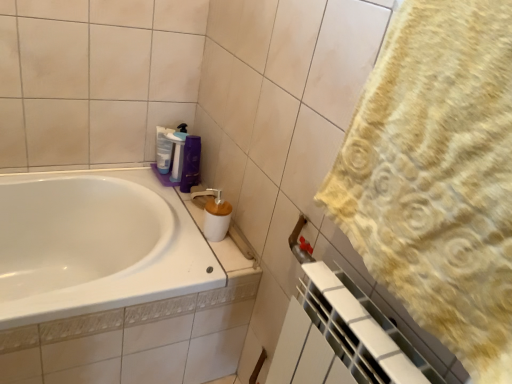
Question: In which direction should I rotate to look at translucent plastic bottle at upper center, the second cleaning product in the right-to-left sequence?

Choices:
 (A) right
 (B) left

Answer: (B)

Question: Does purple glossy shampoo at upper center lie behind translucent plastic bottle at upper center, acting as the first cleaning product starting from the left?

Choices:
 (A) yes
 (B) no

Answer: (B)

Question: Is purple glossy shampoo at upper center looking in the opposite direction of translucent plastic bottle at upper center, acting as the first cleaning product starting from the left?

Choices:
 (A) no
 (B) yes

Answer: (A)

Question: Considering the relative positions of purple glossy shampoo at upper center and translucent plastic bottle at upper center, the second cleaning product in the right-to-left sequence, in the image provided, is purple glossy shampoo at upper center in front of translucent plastic bottle at upper center, the second cleaning product in the right-to-left sequence,?

Choices:
 (A) no
 (B) yes

Answer: (B)

Question: Is purple glossy shampoo at upper center at the right side of translucent plastic bottle at upper center, acting as the first cleaning product starting from the left?

Choices:
 (A) yes
 (B) no

Answer: (A)

Question: Considering the relative sizes of purple glossy shampoo at upper center and translucent plastic bottle at upper center, the second cleaning product in the right-to-left sequence, in the image provided, is purple glossy shampoo at upper center smaller than translucent plastic bottle at upper center, the second cleaning product in the right-to-left sequence,?

Choices:
 (A) yes
 (B) no

Answer: (B)

Question: Is purple glossy shampoo at upper center not within translucent plastic bottle at upper center, acting as the first cleaning product starting from the left?

Choices:
 (A) no
 (B) yes

Answer: (B)

Question: Is purple glossy shampoo at upper center shorter than yellow textured towel at right?

Choices:
 (A) no
 (B) yes

Answer: (B)

Question: From a real-world perspective, is purple glossy shampoo at upper center physically below yellow textured towel at right?

Choices:
 (A) yes
 (B) no

Answer: (A)

Question: Does purple glossy shampoo at upper center appear on the right side of yellow textured towel at right?

Choices:
 (A) no
 (B) yes

Answer: (A)

Question: Is purple glossy shampoo at upper center facing away from yellow textured towel at right?

Choices:
 (A) no
 (B) yes

Answer: (A)

Question: Does purple glossy shampoo at upper center have a greater height compared to yellow textured towel at right?

Choices:
 (A) no
 (B) yes

Answer: (A)

Question: Is purple glossy shampoo at upper center surrounding yellow textured towel at right?

Choices:
 (A) yes
 (B) no

Answer: (B)

Question: From a real-world perspective, is translucent plastic bottle at upper center, the second cleaning product in the right-to-left sequence, positioned under purple plastic bottle at upper center, which ranks as the second cleaning product in left-to-right order, based on gravity?

Choices:
 (A) yes
 (B) no

Answer: (A)